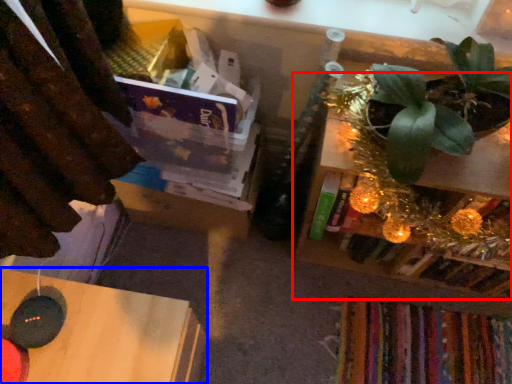
Question: Which object is closer to the camera taking this photo, shelf (highlighted by a red box) or table (highlighted by a blue box)?

Choices:
 (A) shelf
 (B) table

Answer: (B)